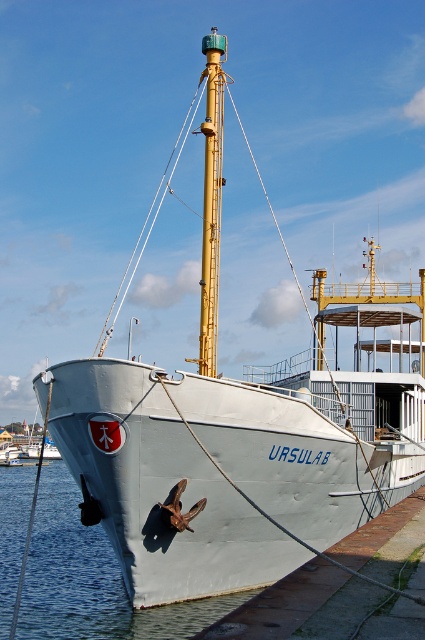
You are standing at the bow of the URSULAB ship looking towards the pier. There are two points marked on the deck. The first point is at coordinates point (79, 582) and the second is at point (212, 326). Which point is closer to you?

Point (212, 326) is closer to you because it is in front of point (79, 582), which is behind it.

You are standing on the pier looking at the URSULAB ship. You notice the metallic gray water at lower left and the yellow metallic mast at center. Which object is positioned to the left of the other?

The metallic gray water at lower left is to the left of the yellow metallic mast at center according to the description.

You are a sailor on the deck of the URSULAB ship. You need to secure a large net that requires anchoring it to the largest object on the deck. Which object should you choose between the metallic gray water at lower left and the yellow metallic mast at center?

The metallic gray water at lower left is larger in size than the yellow metallic mast at center, so you should anchor the net to the metallic gray water at lower left.